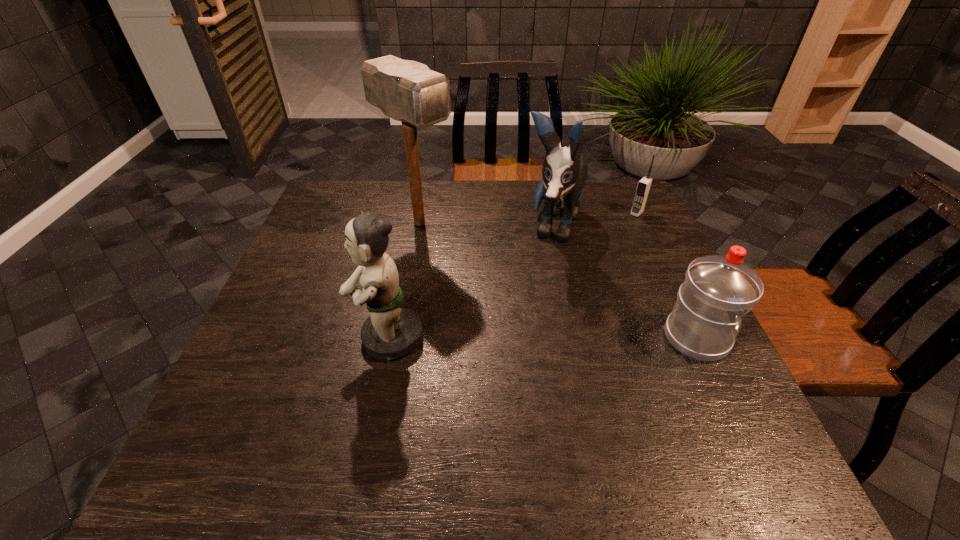
Find the location of a particular element. the fourth closest object to the puppy is located at coordinates (391, 331).

The image size is (960, 540). Identify the location of object that is the fourth closest to the mallet. (718, 290).

You are a GUI agent. You are given a task and a screenshot of the screen. Output one action in this format:
    pyautogui.click(x=<x>, y=<y>)
    Task: Click on the blank space that satisfies the following two spatial constraints: 1. on the front side of the cellular telephone; 2. on the handle side of the second shortest object
    This screenshot has width=960, height=540.
    Given the screenshot: What is the action you would take?
    pyautogui.click(x=696, y=338)

This screenshot has width=960, height=540. I want to click on vacant space that satisfies the following two spatial constraints: 1. on the back side of the shortest object; 2. on the left side of the fourth shortest object, so click(x=549, y=213).